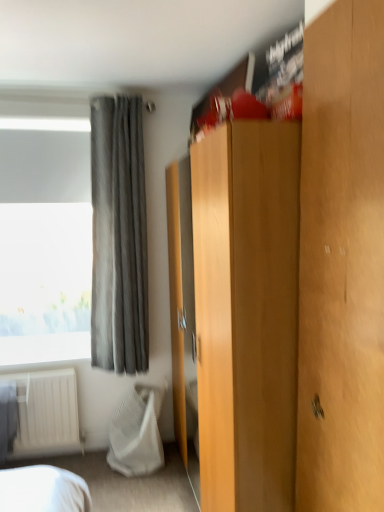
Find the location of a particular element. This screenshot has width=384, height=512. free space in front of white textured blanket at lower left is located at coordinates (133, 489).